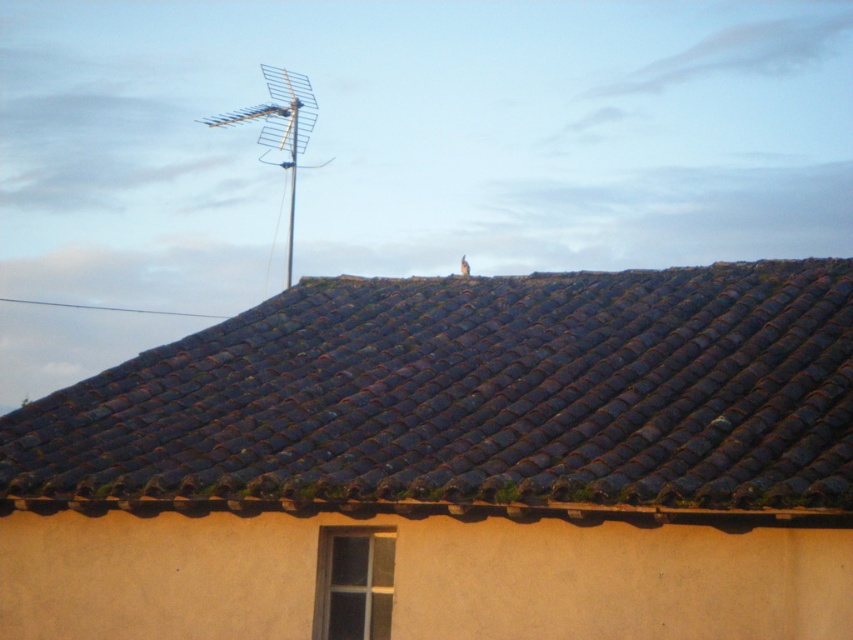
Can you confirm if brown tile roof at upper center is smaller than metallic antenna at upper center?

Correct, brown tile roof at upper center occupies less space than metallic antenna at upper center.

Identify the location of brown tile roof at upper center. This screenshot has width=853, height=640. (476, 396).

Between point (782, 369) and point (201, 122), which one is positioned behind?

Positioned behind is point (201, 122).

This screenshot has width=853, height=640. Find the location of `brown tile roof at upper center`. brown tile roof at upper center is located at coordinates tap(476, 396).